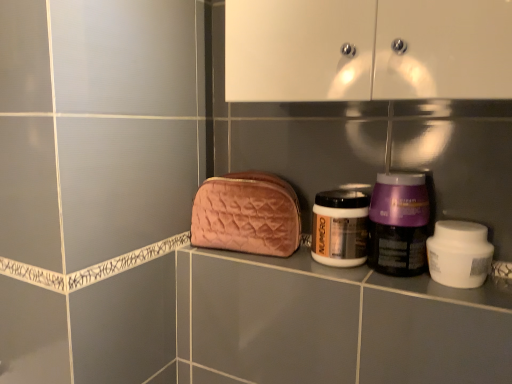
Question: Is velvet pink pouch at center bigger than purple glossy jar at center-right, marked as the second bottle in a left-to-right arrangement?

Choices:
 (A) no
 (B) yes

Answer: (B)

Question: Is velvet pink pouch at center smaller than purple glossy jar at center-right, the 1th bottle when ordered from right to left?

Choices:
 (A) no
 (B) yes

Answer: (A)

Question: Is velvet pink pouch at center not near purple glossy jar at center-right, marked as the second bottle in a left-to-right arrangement?

Choices:
 (A) no
 (B) yes

Answer: (A)

Question: Is the position of velvet pink pouch at center less distant than that of purple glossy jar at center-right, the 1th bottle when ordered from right to left?

Choices:
 (A) yes
 (B) no

Answer: (B)

Question: Would you say velvet pink pouch at center contains purple glossy jar at center-right, marked as the second bottle in a left-to-right arrangement?

Choices:
 (A) yes
 (B) no

Answer: (B)

Question: In terms of width, does matte gold jar at center, the second bottle positioned from the right, look wider or thinner when compared to white matte jar at right?

Choices:
 (A) thin
 (B) wide

Answer: (B)

Question: Does point (354, 238) appear closer or farther from the camera than point (464, 241)?

Choices:
 (A) farther
 (B) closer

Answer: (A)

Question: Is matte gold jar at center, the second bottle positioned from the right, inside or outside of white matte jar at right?

Choices:
 (A) inside
 (B) outside

Answer: (B)

Question: From the image's perspective, is matte gold jar at center, the second bottle positioned from the right, positioned above or below white matte jar at right?

Choices:
 (A) below
 (B) above

Answer: (B)

Question: Is point (449, 241) positioned closer to the camera than point (406, 216)?

Choices:
 (A) farther
 (B) closer

Answer: (B)

Question: Considering their positions, is white matte jar at right located in front of or behind purple glossy jar at center-right, the 1th bottle when ordered from right to left?

Choices:
 (A) front
 (B) behind

Answer: (A)

Question: From a real-world perspective, is white matte jar at right above or below purple glossy jar at center-right, marked as the second bottle in a left-to-right arrangement?

Choices:
 (A) below
 (B) above

Answer: (A)

Question: In terms of width, does white matte jar at right look wider or thinner when compared to purple glossy jar at center-right, the 1th bottle when ordered from right to left?

Choices:
 (A) wide
 (B) thin

Answer: (B)

Question: Based on their sizes in the image, would you say velvet pink pouch at center is bigger or smaller than purple glossy jar at center-right, marked as the second bottle in a left-to-right arrangement?

Choices:
 (A) big
 (B) small

Answer: (A)

Question: From the image's perspective, relative to purple glossy jar at center-right, the 1th bottle when ordered from right to left, is velvet pink pouch at center above or below?

Choices:
 (A) above
 (B) below

Answer: (A)